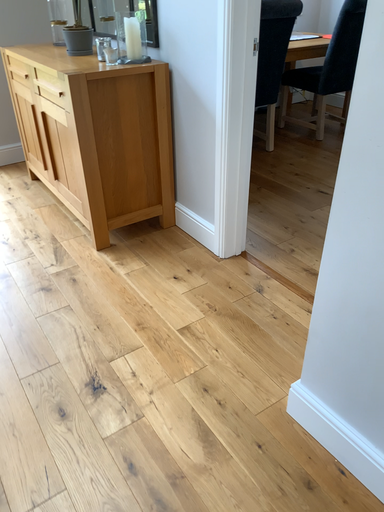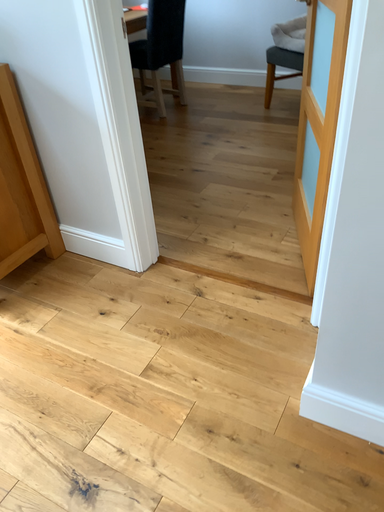
Question: Which way did the camera rotate in the video?

Choices:
 (A) rotated left
 (B) rotated right

Answer: (B)